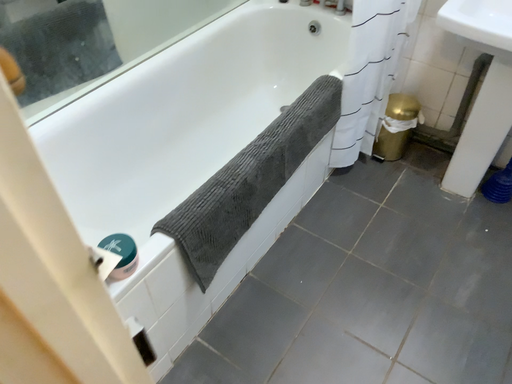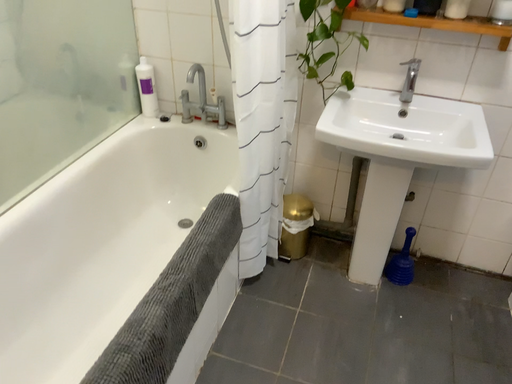
Question: How did the camera likely rotate when shooting the video?

Choices:
 (A) rotated right
 (B) rotated left

Answer: (A)